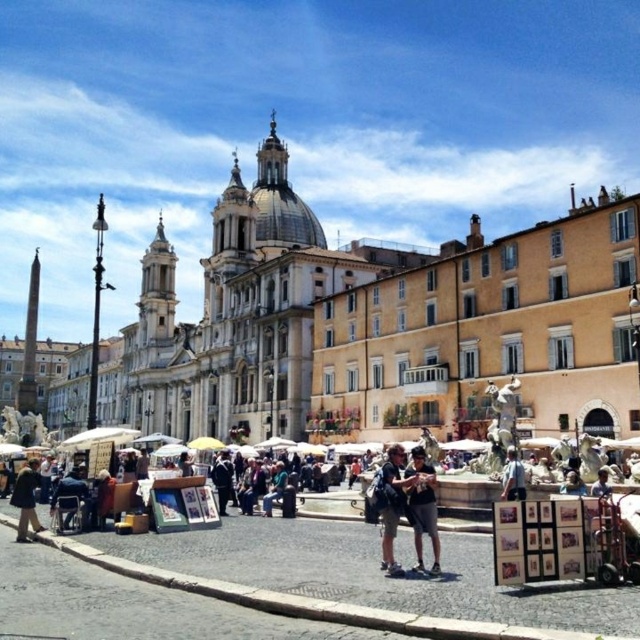
Question: Observing the image, what is the correct spatial positioning of dark blue jeans at center in reference to denim shorts at center?

Choices:
 (A) right
 (B) left

Answer: (A)

Question: Which of the following is the farthest from the observer?

Choices:
 (A) dark blue jeans at center
 (B) brown fur coat at lower left

Answer: (B)

Question: Estimate the real-world distances between objects in this image. Which object is closer to the dark blue jeans at center?

Choices:
 (A) brown fur coat at lower left
 (B) denim shorts at center

Answer: (B)

Question: Which point appears farthest from the camera in this image?

Choices:
 (A) (32, 465)
 (B) (422, 452)

Answer: (A)

Question: Is the position of denim shorts at center more distant than that of brown fur coat at lower left?

Choices:
 (A) no
 (B) yes

Answer: (A)

Question: Does dark blue jeans at center appear on the right side of denim shorts at center?

Choices:
 (A) yes
 (B) no

Answer: (A)